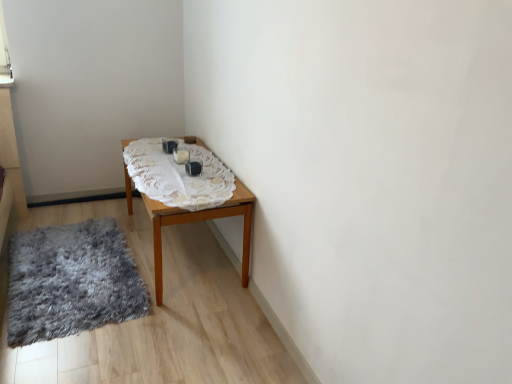
Question: Is shaggy gray rug at lower left turned away from white lace tablecloth at center?

Choices:
 (A) no
 (B) yes

Answer: (A)

Question: Could you tell me if shaggy gray rug at lower left is turned towards white lace tablecloth at center?

Choices:
 (A) yes
 (B) no

Answer: (B)

Question: Can you confirm if shaggy gray rug at lower left is shorter than white lace tablecloth at center?

Choices:
 (A) yes
 (B) no

Answer: (B)

Question: Does shaggy gray rug at lower left contain white lace tablecloth at center?

Choices:
 (A) no
 (B) yes

Answer: (A)

Question: Would you say shaggy gray rug at lower left is a long distance from white lace tablecloth at center?

Choices:
 (A) yes
 (B) no

Answer: (B)

Question: Are shaggy gray rug at lower left and white lace tablecloth at center beside each other?

Choices:
 (A) no
 (B) yes

Answer: (A)

Question: Can you confirm if wooden table at center is thinner than white lace tablecloth at center?

Choices:
 (A) no
 (B) yes

Answer: (B)

Question: From the image's perspective, is wooden table at center below white lace tablecloth at center?

Choices:
 (A) yes
 (B) no

Answer: (A)

Question: Considering the relative sizes of wooden table at center and white lace tablecloth at center in the image provided, is wooden table at center wider than white lace tablecloth at center?

Choices:
 (A) no
 (B) yes

Answer: (A)

Question: From a real-world perspective, is wooden table at center positioned under white lace tablecloth at center based on gravity?

Choices:
 (A) yes
 (B) no

Answer: (A)

Question: Does wooden table at center have a lesser height compared to white lace tablecloth at center?

Choices:
 (A) yes
 (B) no

Answer: (B)

Question: From a real-world perspective, does wooden table at center stand above white lace tablecloth at center?

Choices:
 (A) no
 (B) yes

Answer: (A)

Question: From a real-world perspective, is shaggy gray rug at lower left on top of wooden table at center?

Choices:
 (A) no
 (B) yes

Answer: (A)